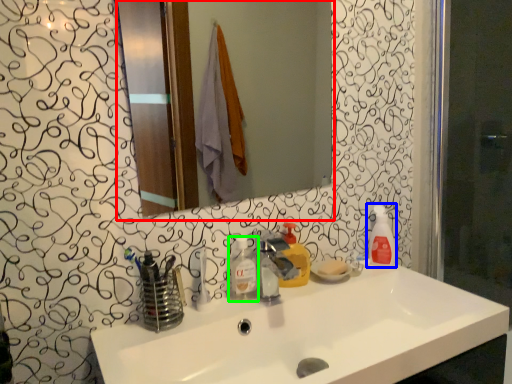
Question: Estimate the real-world distances between objects in this image. Which object is farther from mirror (highlighted by a red box), cleaning product (highlighted by a blue box) or toiletry (highlighted by a green box)?

Choices:
 (A) cleaning product
 (B) toiletry

Answer: (B)